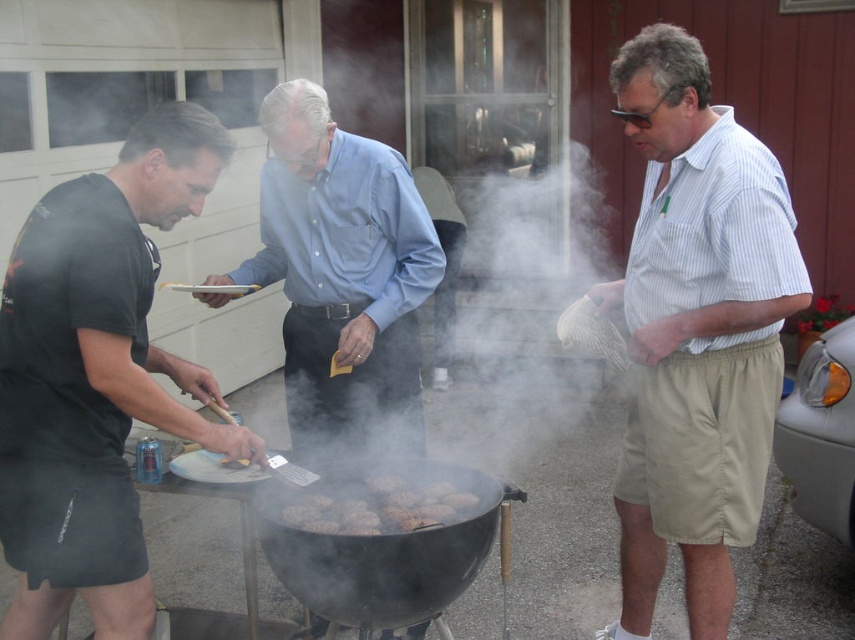
You are planning to place a new burger patty onto the grill. Given the sizes of the black matte barbecue grill at center and the brown crispy burger patties at center, can the grill accommodate another patty without overlapping the existing ones?

The black matte barbecue grill at center is larger in size than brown crispy burger patties at center, so there should be enough space to add another patty without overlapping the existing ones.

You are standing at the point labeled as point (x=388, y=563). Which object is directly below you?

The point (x=388, y=563) is directly above the black matte barbecue grill at center, so the object directly below you is the black matte barbecue grill at center.